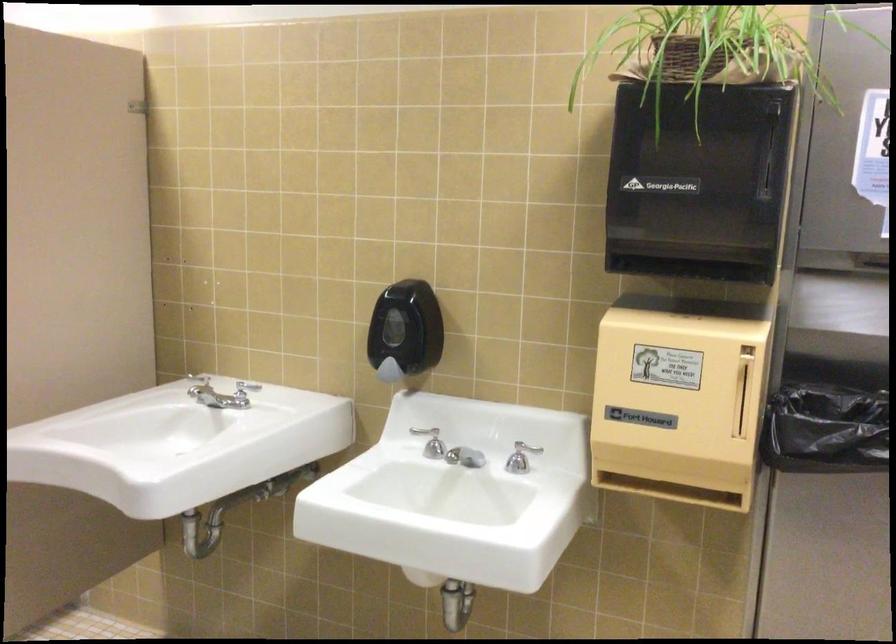
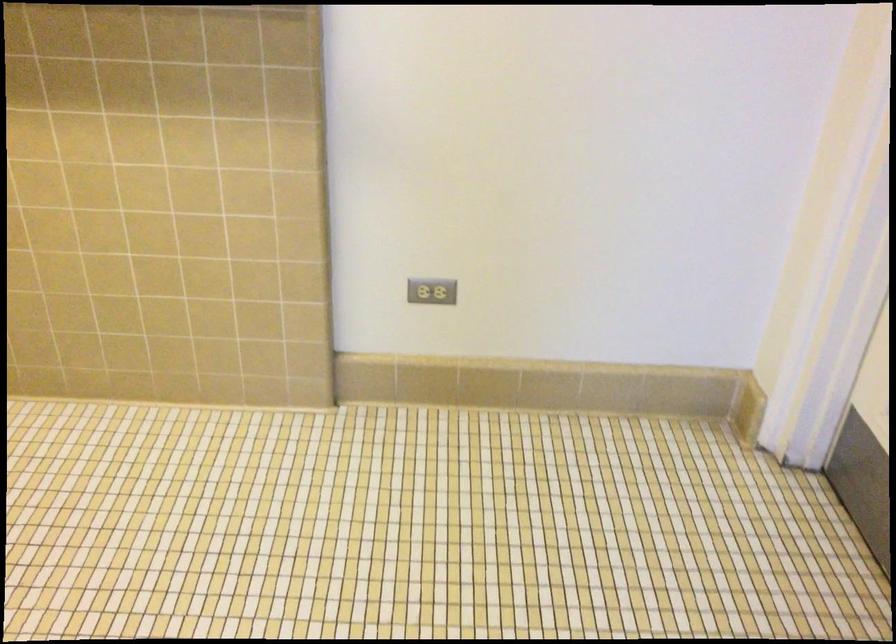
The images are taken continuously from a first-person perspective. In which direction is your viewpoint rotating?

The camera's rotation is toward right-down.